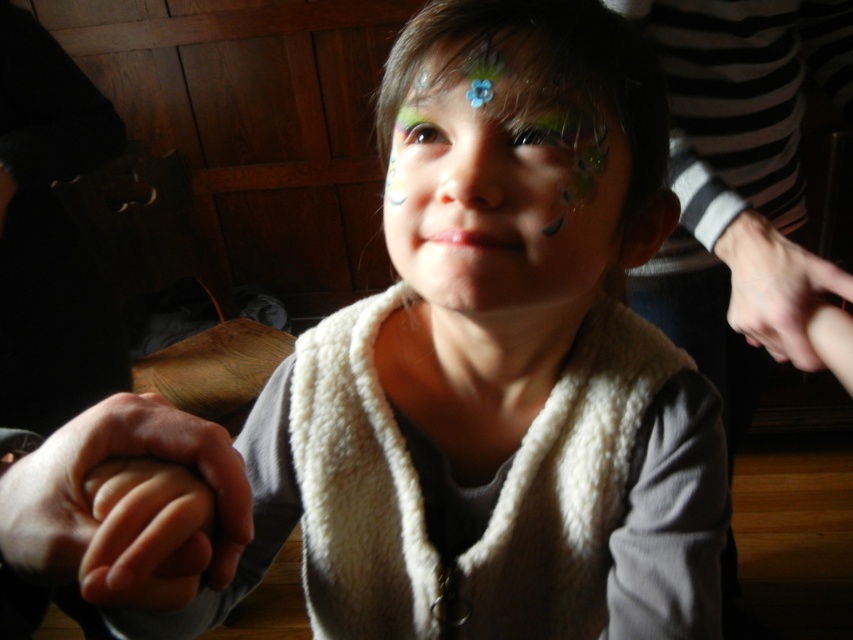
Question: Considering the real-world distances, which object is closest to the smooth skin hand at right?

Choices:
 (A) shiny blue flower at center
 (B) white fluffy vest at center

Answer: (B)

Question: Which point is farther to the camera?

Choices:
 (A) shiny blue flower at center
 (B) smooth skin hand at right
 (C) smooth skin hand at lower left

Answer: (B)

Question: Which object appears farthest from the camera in this image?

Choices:
 (A) white fluffy vest at center
 (B) shiny blue flower at center
 (C) smooth skin hand at lower left
 (D) smooth skin hand at right

Answer: (D)

Question: Is smooth skin hand at lower left bigger than shiny blue flower at center?

Choices:
 (A) yes
 (B) no

Answer: (B)

Question: Is white fluffy vest at center bigger than shiny blue flower at center?

Choices:
 (A) yes
 (B) no

Answer: (A)

Question: Is smooth skin hand at lower left further to the viewer compared to smooth skin hand at right?

Choices:
 (A) no
 (B) yes

Answer: (A)